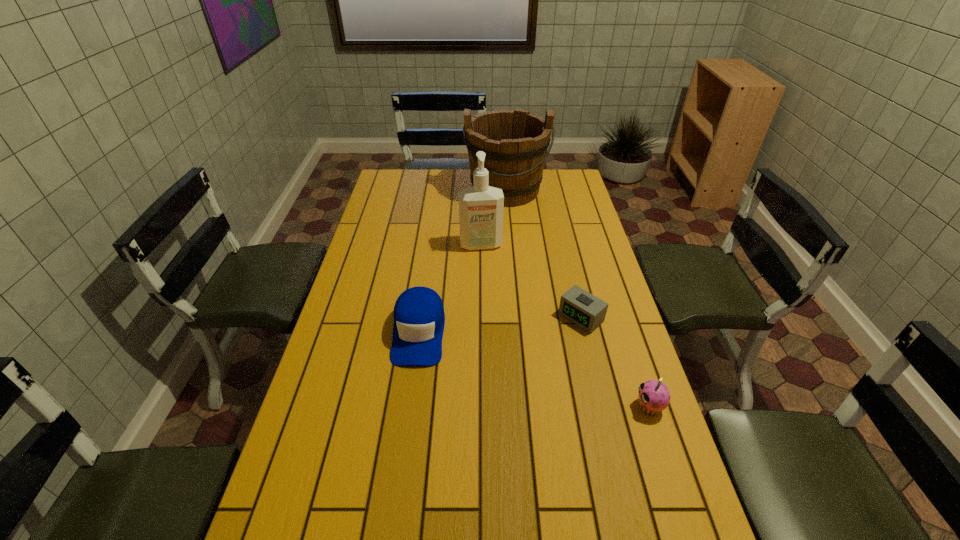
This screenshot has height=540, width=960. Find the location of `vacant space that satisfies the following two spatial constraints: 1. on the front side of the farthest object; 2. on the face of the rightmost object`. vacant space that satisfies the following two spatial constraints: 1. on the front side of the farthest object; 2. on the face of the rightmost object is located at coordinates (524, 407).

Find the location of a particular element. This screenshot has height=540, width=960. vacant area that satisfies the following two spatial constraints: 1. on the front side of the wine bucket; 2. on the face of the nearest object is located at coordinates (524, 407).

Where is `free spot that satisfies the following two spatial constraints: 1. on the front side of the nearest object; 2. on the face of the alarm clock`? This screenshot has height=540, width=960. free spot that satisfies the following two spatial constraints: 1. on the front side of the nearest object; 2. on the face of the alarm clock is located at coordinates (602, 407).